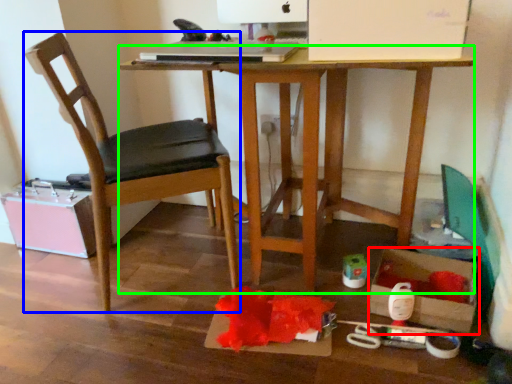
Question: Based on their relative distances, which object is farther from storage box (highlighted by a red box)? Choose from chair (highlighted by a blue box) and desk (highlighted by a green box).

Choices:
 (A) chair
 (B) desk

Answer: (A)